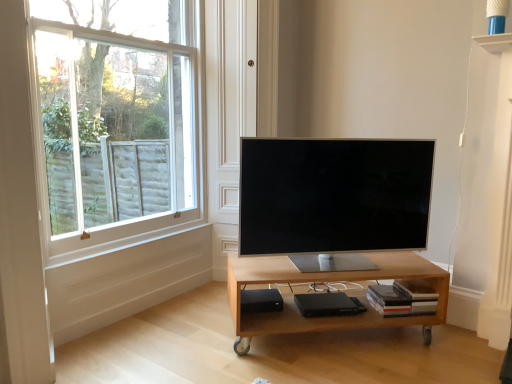
Question: From the image's perspective, does black matte speaker at lower center appear higher than light wood/matte table at center?

Choices:
 (A) yes
 (B) no

Answer: (B)

Question: Is light wood/matte table at center completely or partially inside black matte speaker at lower center?

Choices:
 (A) no
 (B) yes

Answer: (A)

Question: Is black matte speaker at lower center looking in the opposite direction of light wood/matte table at center?

Choices:
 (A) yes
 (B) no

Answer: (A)

Question: Does black matte speaker at lower center have a greater width compared to light wood/matte table at center?

Choices:
 (A) yes
 (B) no

Answer: (B)

Question: Can you confirm if black matte speaker at lower center is positioned to the left of light wood/matte table at center?

Choices:
 (A) yes
 (B) no

Answer: (A)

Question: From a real-world perspective, is light wood/matte table at center physically located above or below white wood window at upper left?

Choices:
 (A) above
 (B) below

Answer: (B)

Question: Which is correct: light wood/matte table at center is inside white wood window at upper left, or outside of it?

Choices:
 (A) inside
 (B) outside

Answer: (B)

Question: Considering the relative positions of light wood/matte table at center and white wood window at upper left in the image provided, is light wood/matte table at center to the left or to the right of white wood window at upper left?

Choices:
 (A) left
 (B) right

Answer: (B)

Question: Looking at their shapes, would you say light wood/matte table at center is wider or thinner than white wood window at upper left?

Choices:
 (A) wide
 (B) thin

Answer: (A)

Question: Is light wood/matte table at center to the left or to the right of satin silver tv at center in the image?

Choices:
 (A) left
 (B) right

Answer: (A)

Question: Is light wood/matte table at center taller or shorter than satin silver tv at center?

Choices:
 (A) short
 (B) tall

Answer: (A)

Question: In terms of size, does light wood/matte table at center appear bigger or smaller than satin silver tv at center?

Choices:
 (A) small
 (B) big

Answer: (B)

Question: Is point (352, 322) closer or farther from the camera than point (304, 175)?

Choices:
 (A) closer
 (B) farther

Answer: (B)

Question: From the image's perspective, is black matte speaker at lower center positioned above or below light wood/matte table at center?

Choices:
 (A) above
 (B) below

Answer: (B)

Question: Choose the correct answer: Is black matte speaker at lower center inside light wood/matte table at center or outside it?

Choices:
 (A) outside
 (B) inside

Answer: (B)